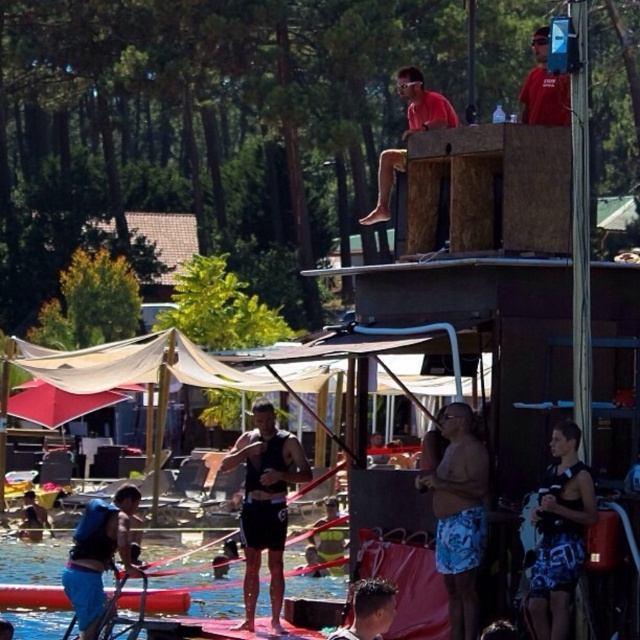
Which is more to the right, blue printed shorts at lower right or blue fabric life vest at lower left?

From the viewer's perspective, blue printed shorts at lower right appears more on the right side.

Is blue printed shorts at lower right taller than blue fabric life vest at lower left?

Yes, blue printed shorts at lower right is taller than blue fabric life vest at lower left.

Between point (556, 476) and point (104, 515), which one is positioned in front?

Positioned in front is point (556, 476).

Locate an element on the screen. blue printed shorts at lower right is located at coordinates (560, 532).

Does blue fabric life vest at lower left have a greater height compared to matte red shirt at upper center?

No.

Between blue fabric life vest at lower left and matte red shirt at upper center, which one appears on the left side from the viewer's perspective?

blue fabric life vest at lower left

This screenshot has width=640, height=640. What are the coordinates of `blue fabric life vest at lower left` in the screenshot? It's located at (97, 556).

I want to click on blue fabric water at lower left, so click(x=33, y=586).

In the scene shown: Between blue fabric water at lower left and red matte shirt at upper center, which one appears on the left side from the viewer's perspective?

blue fabric water at lower left

Who is more forward, (x=29, y=552) or (x=564, y=80)?

Positioned in front is point (x=564, y=80).

Where is `blue fabric water at lower left`? blue fabric water at lower left is located at coordinates (33, 586).